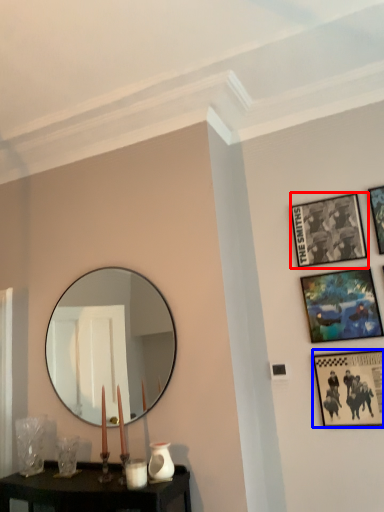
Question: Which point is closer to the camera, picture frame (highlighted by a red box) or picture frame (highlighted by a blue box)?

Choices:
 (A) picture frame
 (B) picture frame

Answer: (B)